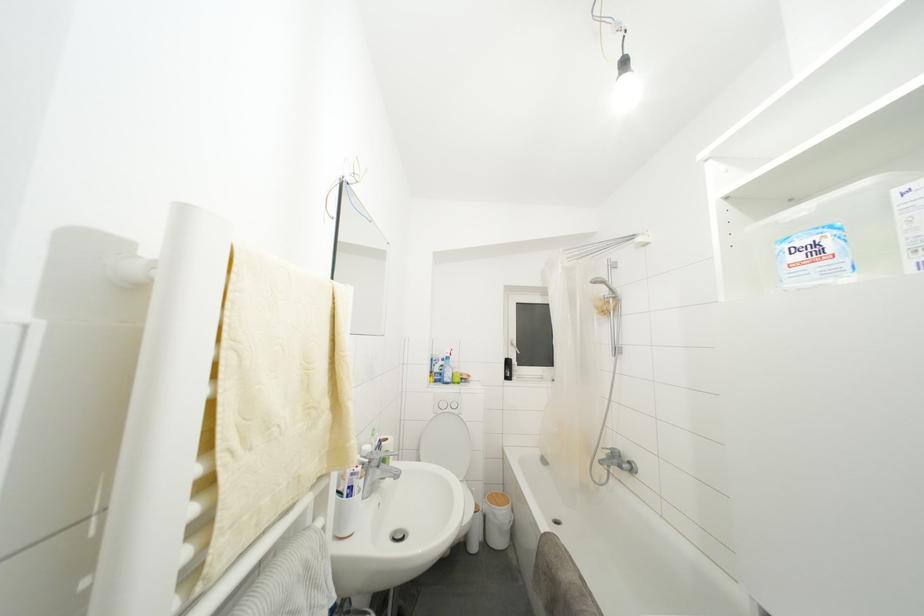
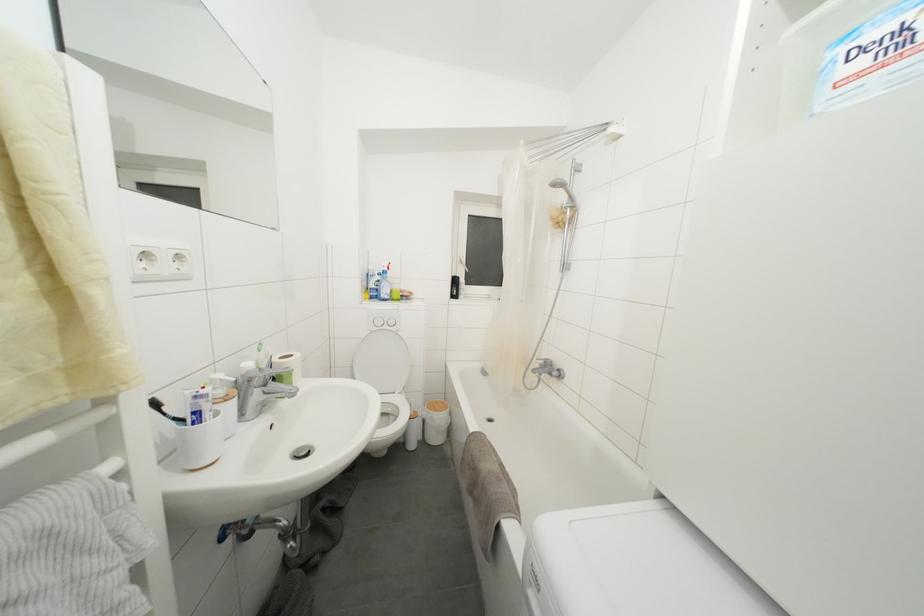
Where in the second image is the point corresponding to [443,383] from the first image?

(379, 300)